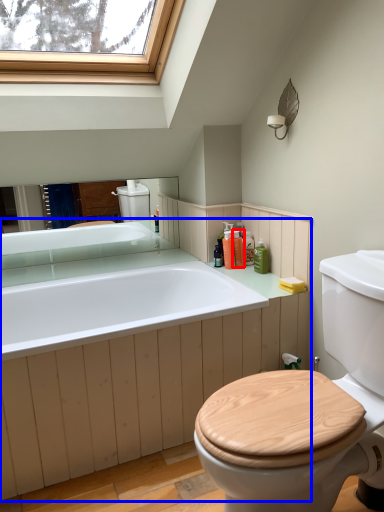
Question: Among these objects, which one is farthest to the camera, toiletry (highlighted by a red box) or counter top (highlighted by a blue box)?

Choices:
 (A) toiletry
 (B) counter top

Answer: (A)